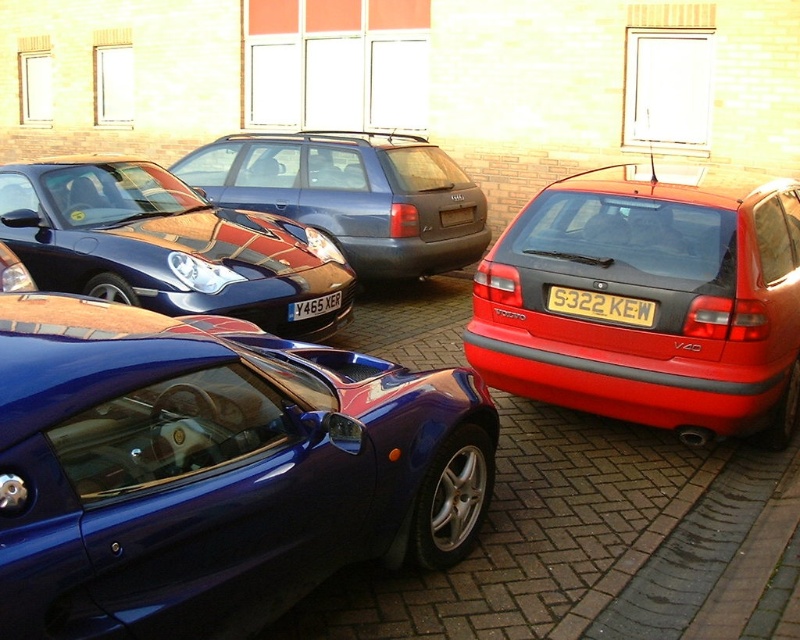
You are driving a car and want to park in the parking area shown. You see the shiny metallic car at center and the yellow matte license plate at center. Which object is closer to you as you approach the parking spot?

The shiny metallic car at center is closer to you because it is in front of the yellow matte license plate at center.

You are standing at the point marked by the coordinates (650,300) in the parking lot. Which car are you closest to?

The point marked by the coordinates (650,300) is on the glossy red hatchback at right, so you are closest to the glossy red hatchback at right.